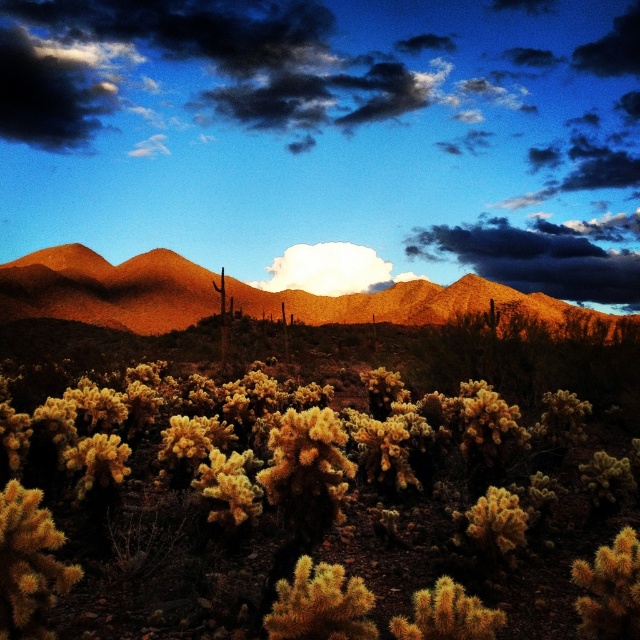
You are an astronomer observing the desert sky. You notice the rustic brown mountains at upper center and the dark gray cloud at upper center. Which object is positioned lower in the image?

The rustic brown mountains at upper center is positioned lower than the dark gray cloud at upper center.

You are an astronomer observing the desert sky. You notice the rustic brown mountains at upper center and the dark gray cloud at upper center. Which object is higher in the sky?

The dark gray cloud at upper center is higher in the sky than the rustic brown mountains at upper center because the cloud is taller than the mountains.

In the scene shown: You are a photographer standing in the desert and want to capture both the rustic brown mountains at upper center and the dark gray cloud at upper center in a single shot. Given that your camera has a maximum focus range of 20 meters, will you be able to focus on both objects simultaneously?

The rustic brown mountains at upper center is 22.69 meters away from the dark gray cloud at upper center. Since the distance between them exceeds the camera maximum focus range of 20 meters, you won be able to focus on both objects simultaneously.